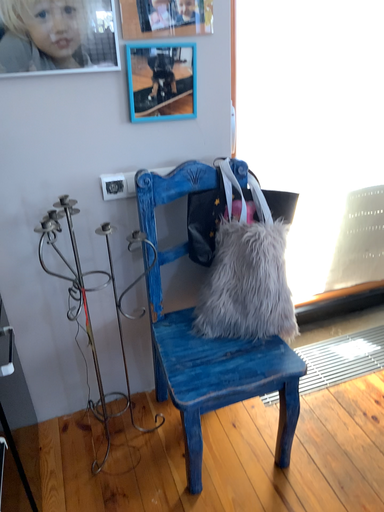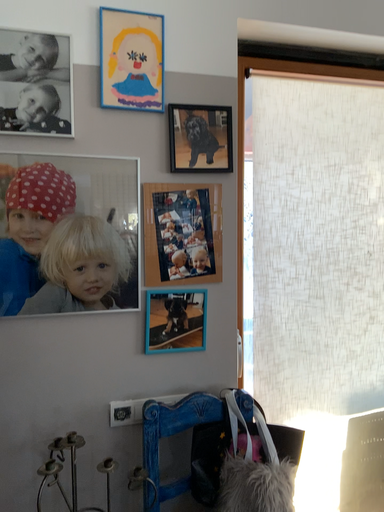
Question: How did the camera likely rotate when shooting the video?

Choices:
 (A) rotated upward
 (B) rotated downward

Answer: (A)